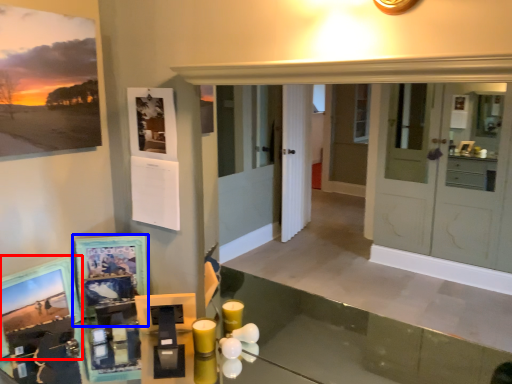
Question: Which of the following is the closest to the observer, picture frame (highlighted by a red box) or picture frame (highlighted by a blue box)?

Choices:
 (A) picture frame
 (B) picture frame

Answer: (A)